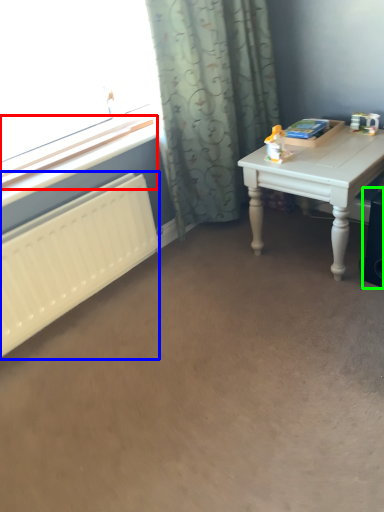
Question: Which is farther away from window sill (highlighted by a red box)? radiator (highlighted by a blue box) or speaker (highlighted by a green box)?

Choices:
 (A) radiator
 (B) speaker

Answer: (B)